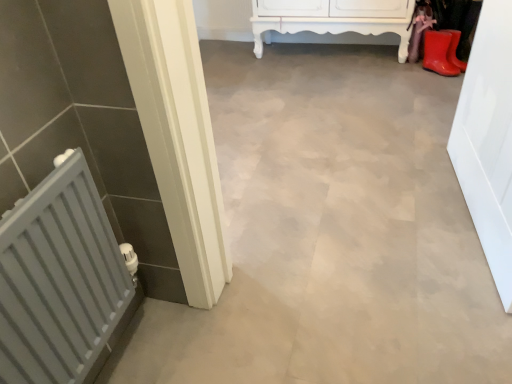
This screenshot has height=384, width=512. In order to click on vacant space underneath white glossy door at right (from a real-world perspective) in this screenshot , I will do `click(479, 228)`.